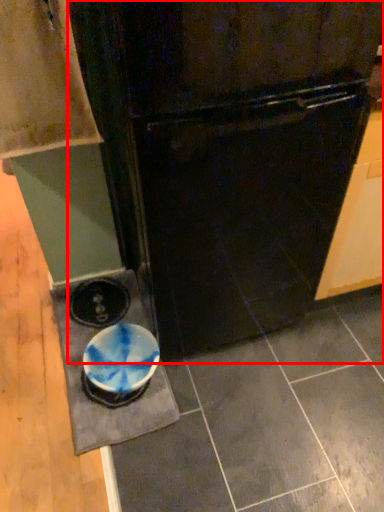
Question: From the image's perspective, where is refrigerator (annotated by the red box) located relative to cabinetry?

Choices:
 (A) below
 (B) above

Answer: (A)